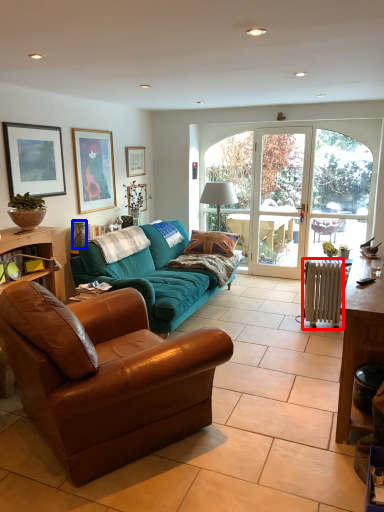
Question: Among these objects, which one is farthest to the camera, radiator (highlighted by a red box) or vase (highlighted by a blue box)?

Choices:
 (A) radiator
 (B) vase

Answer: (B)